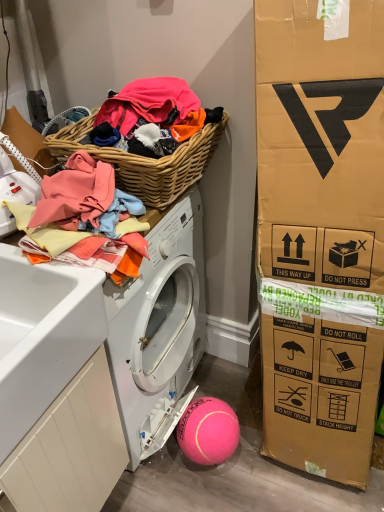
Locate an element on the screen. Image resolution: width=384 pixels, height=512 pixels. blank space situated above pink rubber ball at lower center (from a real-world perspective) is located at coordinates (208, 416).